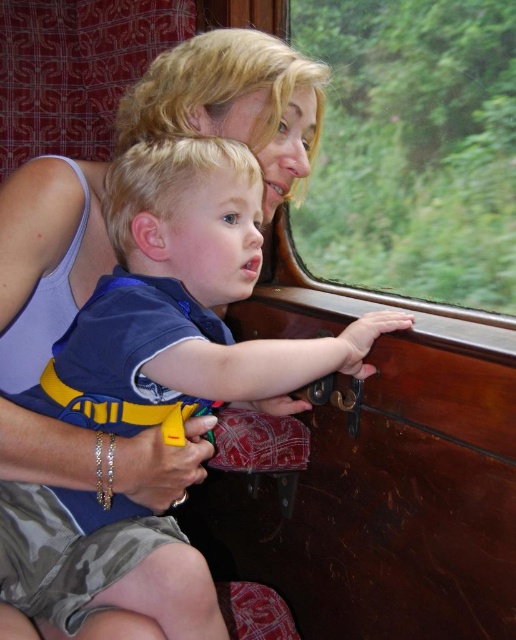
Question: Is blue cotton shirt at center thinner than transparent glass window at upper center?

Choices:
 (A) yes
 (B) no

Answer: (B)

Question: Does blue cotton shirt at center have a lesser width compared to transparent glass window at upper center?

Choices:
 (A) yes
 (B) no

Answer: (B)

Question: Can you confirm if blue cotton shirt at center is positioned below transparent glass window at upper center?

Choices:
 (A) no
 (B) yes

Answer: (B)

Question: Which object appears farthest from the camera in this image?

Choices:
 (A) blue cotton shirt at center
 (B) transparent glass window at upper center

Answer: (B)